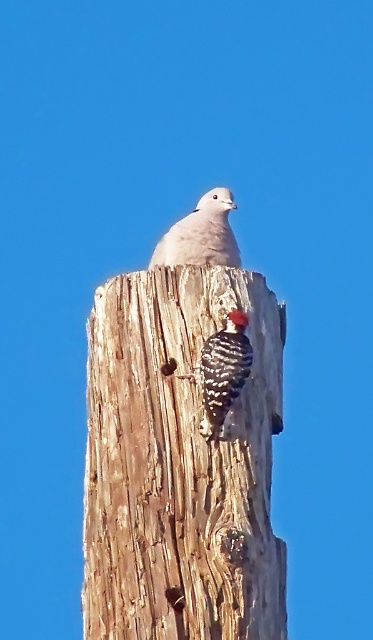
At what (x,y) coordinates should I click in order to perform the action: click on wooden log at center. Please return your answer as a coordinate pair (x, y). The image size is (373, 640). Looking at the image, I should click on (180, 465).

Locate an element on the screen. wooden log at center is located at coordinates (180, 465).

Locate an element on the screen. Image resolution: width=373 pixels, height=640 pixels. wooden log at center is located at coordinates (180, 465).

Is wooden log at center shorter than speckled brown woodpecker at center?

No.

This screenshot has width=373, height=640. What do you see at coordinates (180, 465) in the screenshot?
I see `wooden log at center` at bounding box center [180, 465].

Locate an element on the screen. The image size is (373, 640). wooden log at center is located at coordinates (180, 465).

Can you confirm if white feathered bird at center is bigger than speckled brown woodpecker at center?

Indeed, white feathered bird at center has a larger size compared to speckled brown woodpecker at center.

Can you confirm if white feathered bird at center is smaller than speckled brown woodpecker at center?

Actually, white feathered bird at center might be larger than speckled brown woodpecker at center.

The height and width of the screenshot is (640, 373). What are the coordinates of `white feathered bird at center` in the screenshot? It's located at (201, 234).